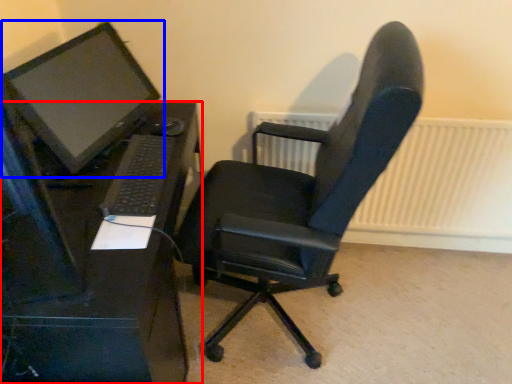
Question: Which object is closer to the camera taking this photo, desk (highlighted by a red box) or computer monitor (highlighted by a blue box)?

Choices:
 (A) desk
 (B) computer monitor

Answer: (A)